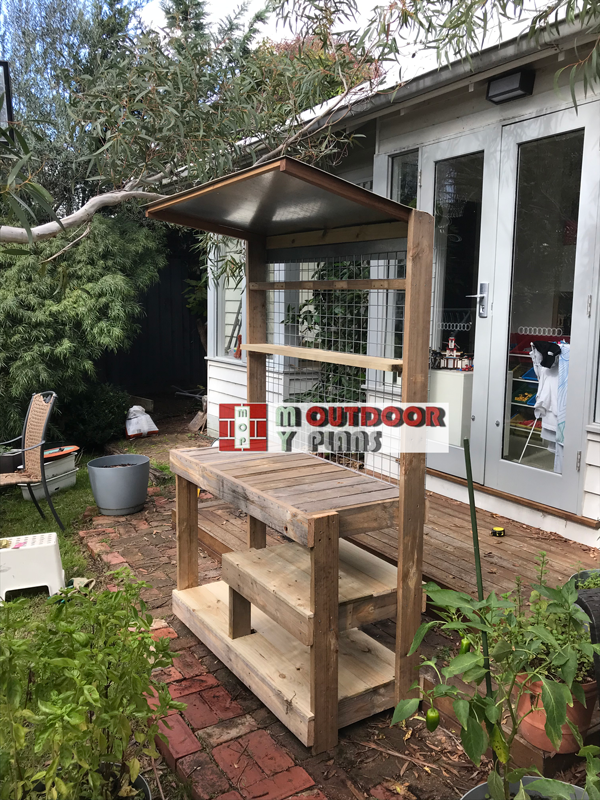
Find the location of a particular element. This screenshot has width=600, height=800. table is located at coordinates (303, 516).